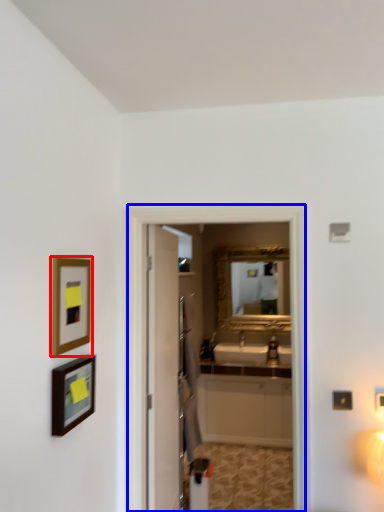
Question: Which object appears farthest to the camera in this image, picture frame (highlighted by a red box) or screen door (highlighted by a blue box)?

Choices:
 (A) picture frame
 (B) screen door

Answer: (B)